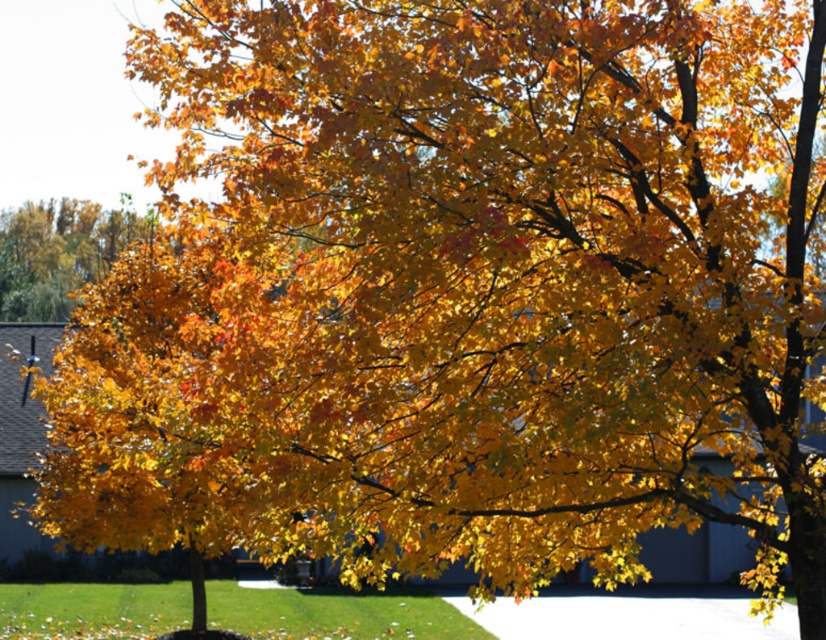
You are standing in the autumn scene and want to walk to the residential area in the background. Which direction should you move relative to the white concrete pavement at lower center and the golden yellow leaves at upper left?

To reach the residential area in the background, you should move away from the white concrete pavement at lower center, which is closer to you, and towards the golden yellow leaves at upper left, which are further away. This direction aligns with the background where the residential area is located.

You are standing on the grass under the tree and want to walk to the white concrete pavement at lower center. Which direction should you walk relative to the golden yellow leaves at upper left?

You should walk to the right side of the golden yellow leaves at upper left to reach the white concrete pavement at lower center because the white concrete pavement at lower center is positioned on the right side of golden yellow leaves at upper left.

You are standing in the autumn scene and want to walk from the point at coordinates point [554,605] to the point at coordinates point [103,218]. Which direction should you face to walk directly towards your destination?

You should face towards the point at coordinates point [103,218], which is behind the point at coordinates point [554,605]. Since point [554,605] is in front of point [103,218], you need to walk backwards or turn around to face the direction of point [103,218].